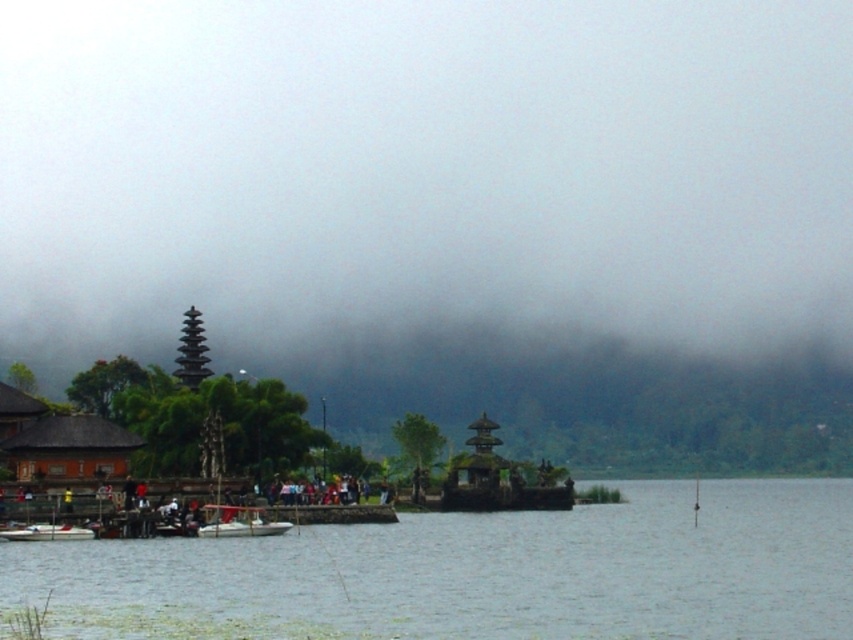
Question: Is foggy atmosphere at center positioned before white plastic boat at center?

Choices:
 (A) yes
 (B) no

Answer: (B)

Question: Can you confirm if white plastic boat at center is positioned to the left of white plastic boat at lower left?

Choices:
 (A) no
 (B) yes

Answer: (A)

Question: Which of the following is the farthest from the observer?

Choices:
 (A) white plastic boat at center
 (B) white plastic boat at lower left

Answer: (A)

Question: In this image, where is foggy atmosphere at center located relative to white plastic boat at center?

Choices:
 (A) above
 (B) below

Answer: (A)

Question: Which object appears closest to the camera in this image?

Choices:
 (A) foggy atmosphere at center
 (B) clear water at center

Answer: (B)

Question: Which point is farther to the camera?

Choices:
 (A) (45, 538)
 (B) (221, 504)

Answer: (B)